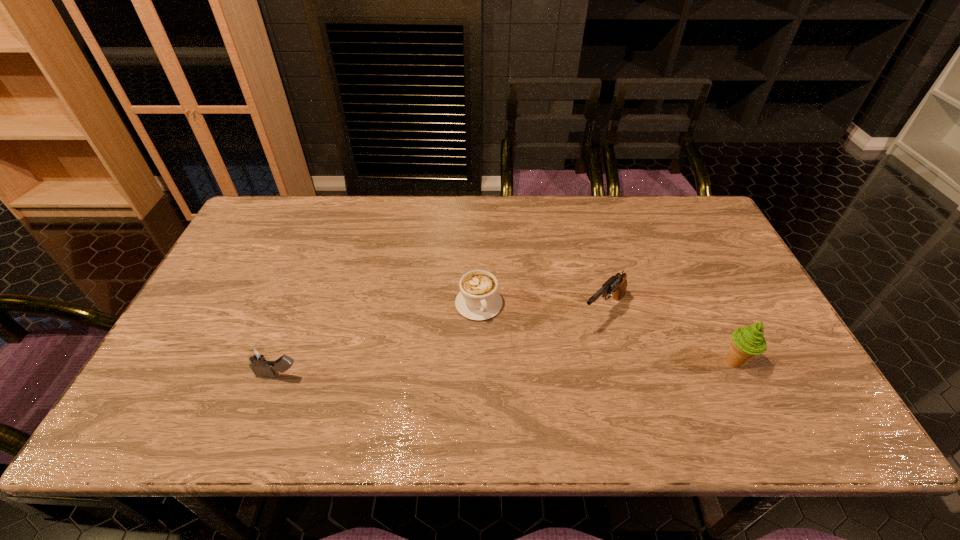
This screenshot has height=540, width=960. What are the coordinates of `vacant region at the right edge of the desktop` in the screenshot? It's located at (710, 315).

Image resolution: width=960 pixels, height=540 pixels. In order to click on vacant space at the far left corner in this screenshot , I will do `click(242, 234)`.

Image resolution: width=960 pixels, height=540 pixels. In order to click on vacant point located between the third object from right to left and the gun in this screenshot , I will do `click(541, 307)`.

Locate an element on the screen. Image resolution: width=960 pixels, height=540 pixels. vacant space in between the icecream and the second object from right to left is located at coordinates (669, 336).

Image resolution: width=960 pixels, height=540 pixels. Identify the location of vacant area that lies between the third object from left to right and the cappuccino. (541, 307).

Find the location of a particular element. The image size is (960, 540). blank region between the leftmost object and the second object from right to left is located at coordinates (442, 343).

What are the coordinates of `free area in between the rightmost object and the shortest object` in the screenshot? It's located at (607, 333).

Find the location of a particular element. This screenshot has height=540, width=960. empty space between the leftmost object and the rightmost object is located at coordinates (507, 368).

Where is `free space that is in between the rightmost object and the gun`? Image resolution: width=960 pixels, height=540 pixels. free space that is in between the rightmost object and the gun is located at coordinates (669, 336).

This screenshot has height=540, width=960. Find the location of `free spot between the shortest object and the gun`. free spot between the shortest object and the gun is located at coordinates (541, 307).